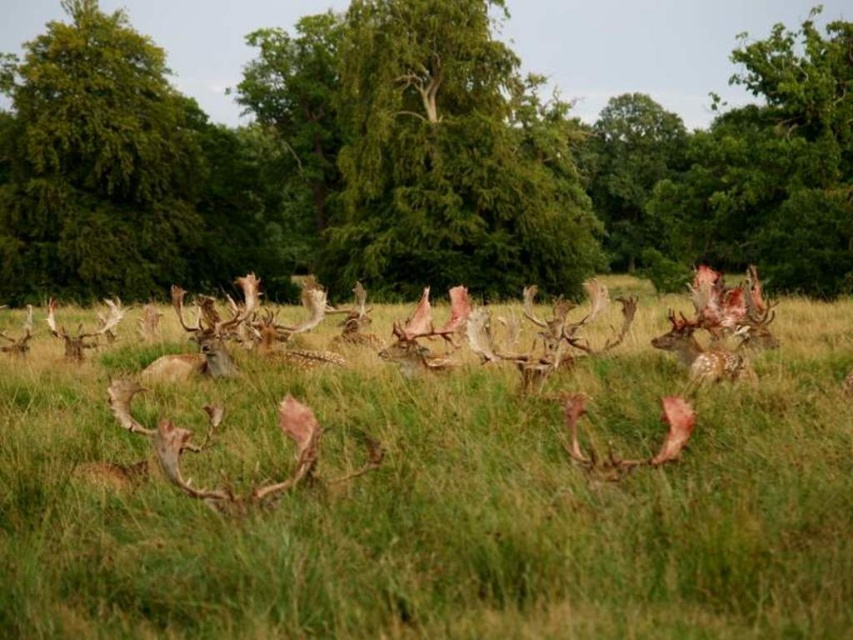
Does green leafy tree at upper left lie in front of spotted fur antlers at center?

No, green leafy tree at upper left is behind spotted fur antlers at center.

Is green leafy tree at upper left below spotted fur antlers at center?

No, green leafy tree at upper left is not below spotted fur antlers at center.

Is point (169, 268) farther from viewer compared to point (676, 321)?

Yes.

The height and width of the screenshot is (640, 853). I want to click on green leafy tree at upper left, so click(x=96, y=163).

Does fawn fur antlers at center have a lesser width compared to green leafy tree at upper left?

Yes.

Is fawn fur antlers at center below green leafy tree at upper left?

Indeed, fawn fur antlers at center is positioned under green leafy tree at upper left.

Between point (325, 452) and point (155, 289), which one is positioned in front?

Point (325, 452) is in front.

Find the location of a particular element. fawn fur antlers at center is located at coordinates (436, 509).

Which is behind, point (787, 152) or point (120, 36)?

The point (120, 36) is behind.

Is green leafy tree at center positioned behind green leafy tree at upper left?

No, green leafy tree at center is closer to the viewer.

This screenshot has width=853, height=640. In order to click on green leafy tree at center in this screenshot , I will do `click(410, 161)`.